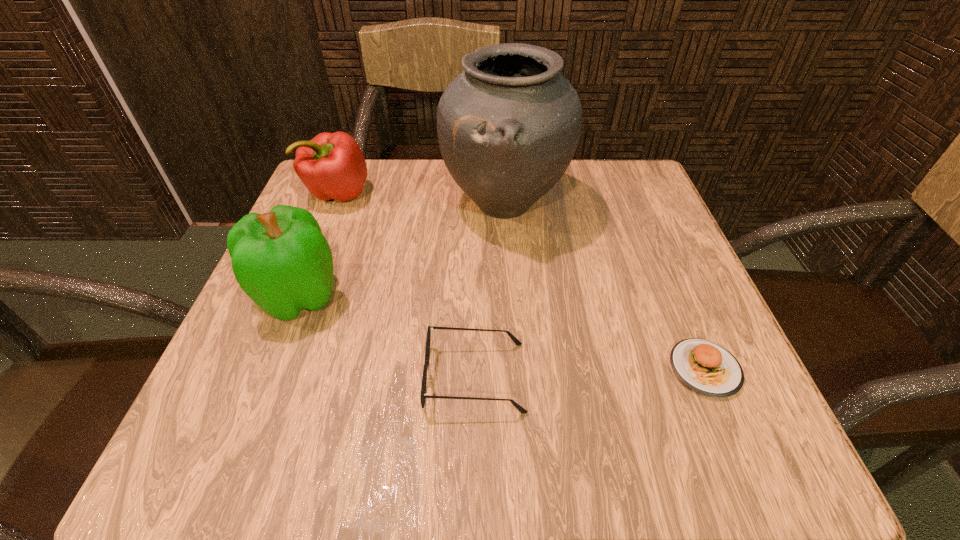
You are a GUI agent. You are given a task and a screenshot of the screen. Output one action in this format:
    pyautogui.click(x=<x>, y=<y>)
    Task: Click on the free spot between the spectacles and the shortest object
    The image size is (960, 540).
    Given the screenshot: What is the action you would take?
    pyautogui.click(x=590, y=373)

I want to click on vacant space in between the third nearest object and the urn, so [402, 250].

The height and width of the screenshot is (540, 960). Find the location of `vacant space in between the third tallest object and the second shortest object`. vacant space in between the third tallest object and the second shortest object is located at coordinates (406, 286).

Point out which object is positioned as the nearest to the food. Please provide its 2D coordinates. Your answer should be formatted as a tuple, i.e. [(x, y)], where the tuple contains the x and y coordinates of a point satisfying the conditions above.

[(423, 395)]

Where is `the closest object relative to the urn`? The width and height of the screenshot is (960, 540). the closest object relative to the urn is located at coordinates (281, 260).

This screenshot has height=540, width=960. What are the coordinates of `free space that satisfies the following two spatial constraints: 1. on the front side of the third shortest object; 2. on the left side of the rightmost object` in the screenshot? It's located at (x=268, y=369).

I want to click on free space that satisfies the following two spatial constraints: 1. on the back side of the urn; 2. on the left side of the nearer bell pepper, so tap(335, 204).

In order to click on free space that satisfies the following two spatial constraints: 1. on the front side of the urn; 2. with the lenses facing outward on the fourth tallest object in this screenshot , I will do `click(516, 377)`.